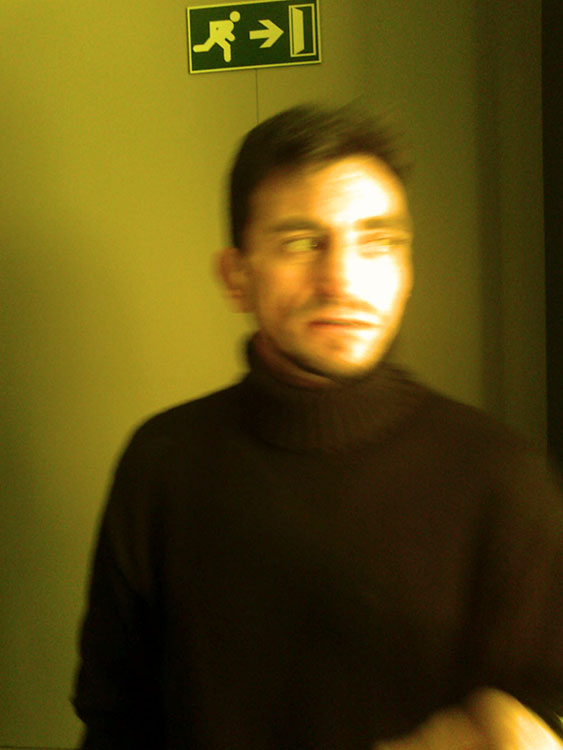
You are a GUI agent. You are given a task and a screenshot of the screen. Output one action in this format:
    pyautogui.click(x=<x>, y=<y>)
    Task: Click on the open door
    
    Given the screenshot: What is the action you would take?
    pyautogui.click(x=303, y=32)